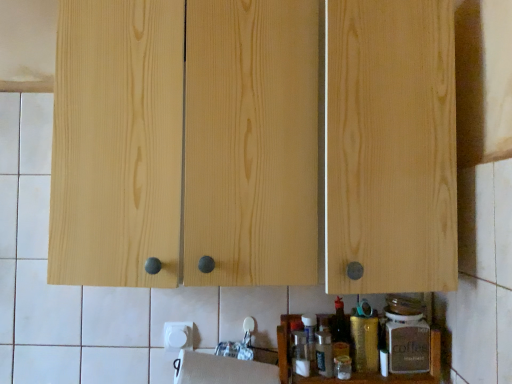
What is the approximate height of matte brown glass coffee jar at lower right, marked as the 1th bottle in a right-to-left arrangement?

The height of matte brown glass coffee jar at lower right, marked as the 1th bottle in a right-to-left arrangement, is 6.23 inches.

Find the location of a particular element. The image size is (512, 384). matte brown glass coffee jar at lower right, which ranks as the 2th bottle in left-to-right order is located at coordinates (407, 336).

Measure the distance between point (170, 325) and camera.

A distance of 1.25 meters exists between point (170, 325) and camera.

Image resolution: width=512 pixels, height=384 pixels. What are the coordinates of `matte brown glass coffee jar at lower right, which ranks as the 2th bottle in left-to-right order` in the screenshot? It's located at (407, 336).

Could you tell me if matte brown glass coffee jar at lower right, marked as the 1th bottle in a right-to-left arrangement, is facing gold metallic canister at lower center, placed as the first bottle when sorted from left to right?

No, matte brown glass coffee jar at lower right, marked as the 1th bottle in a right-to-left arrangement, is not oriented towards gold metallic canister at lower center, placed as the first bottle when sorted from left to right.

Can you see matte brown glass coffee jar at lower right, marked as the 1th bottle in a right-to-left arrangement, touching gold metallic canister at lower center, the 2th bottle viewed from the right?

Yes.

Is matte brown glass coffee jar at lower right, marked as the 1th bottle in a right-to-left arrangement, completely or partially outside of gold metallic canister at lower center, the 2th bottle viewed from the right?

Absolutely, matte brown glass coffee jar at lower right, marked as the 1th bottle in a right-to-left arrangement, is external to gold metallic canister at lower center, the 2th bottle viewed from the right.

The image size is (512, 384). There is a natural wood cabinet at center. Find the location of `the 1st bottle below it (from a real-world perspective)`. the 1st bottle below it (from a real-world perspective) is located at coordinates (407, 336).

Which is more to the right, natural wood cabinet at center or matte brown glass coffee jar at lower right, which ranks as the 2th bottle in left-to-right order?

Positioned to the right is matte brown glass coffee jar at lower right, which ranks as the 2th bottle in left-to-right order.

Considering the sizes of objects natural wood cabinet at center and matte brown glass coffee jar at lower right, marked as the 1th bottle in a right-to-left arrangement, in the image provided, who is wider, natural wood cabinet at center or matte brown glass coffee jar at lower right, marked as the 1th bottle in a right-to-left arrangement,?

natural wood cabinet at center is wider.

Between natural wood cabinet at center and matte brown glass coffee jar at lower right, marked as the 1th bottle in a right-to-left arrangement, which one has less height?

matte brown glass coffee jar at lower right, marked as the 1th bottle in a right-to-left arrangement.

How much distance is there between white matte paper towel at lower center and wooden spice rack at lower center?

A distance of 15.23 inches exists between white matte paper towel at lower center and wooden spice rack at lower center.

Does white matte paper towel at lower center have a lesser width compared to wooden spice rack at lower center?

Indeed, white matte paper towel at lower center has a lesser width compared to wooden spice rack at lower center.

Based on the photo, considering the relative sizes of white matte paper towel at lower center and wooden spice rack at lower center in the image provided, is white matte paper towel at lower center shorter than wooden spice rack at lower center?

Correct, white matte paper towel at lower center is not as tall as wooden spice rack at lower center.

In terms of size, does white matte paper towel at lower center appear bigger or smaller than wooden spice rack at lower center?

white matte paper towel at lower center is smaller than wooden spice rack at lower center.

You are a GUI agent. You are given a task and a screenshot of the screen. Output one action in this format:
    pyautogui.click(x=<x>, y=<y>)
    Task: Click on the cabinet that is in front of the white matte paper towel at lower center
    Image resolution: width=512 pixels, height=384 pixels.
    Given the screenshot: What is the action you would take?
    pyautogui.click(x=356, y=373)

Would you say wooden spice rack at lower center is inside or outside white matte paper towel at lower center?

wooden spice rack at lower center is outside white matte paper towel at lower center.

Is wooden spice rack at lower center shorter than white matte paper towel at lower center?

In fact, wooden spice rack at lower center may be taller than white matte paper towel at lower center.

Which is in front, point (372, 318) or point (420, 306)?

The point (420, 306) is more forward.

I want to click on bottle above the gold metallic canister at lower center, the 2th bottle viewed from the right (from the image's perspective), so click(407, 336).

Is gold metallic canister at lower center, the 2th bottle viewed from the right, turned away from matte brown glass coffee jar at lower right, which ranks as the 2th bottle in left-to-right order?

No, gold metallic canister at lower center, the 2th bottle viewed from the right, is not facing the opposite direction of matte brown glass coffee jar at lower right, which ranks as the 2th bottle in left-to-right order.

Is natural wood cabinet at center oriented away from wooden spice rack at lower center?

natural wood cabinet at center does not have its back to wooden spice rack at lower center.

From a real-world perspective, is natural wood cabinet at center physically below wooden spice rack at lower center?

No, from a real-world perspective, natural wood cabinet at center is not under wooden spice rack at lower center.

Is natural wood cabinet at center next to wooden spice rack at lower center?

No, natural wood cabinet at center is not next to wooden spice rack at lower center.

Does natural wood cabinet at center have a greater width compared to wooden spice rack at lower center?

Yes.

Between white matte paper towel at lower center and gold metallic canister at lower center, placed as the first bottle when sorted from left to right, which one appears on the right side from the viewer's perspective?

gold metallic canister at lower center, placed as the first bottle when sorted from left to right.

Is white matte paper towel at lower center oriented away from gold metallic canister at lower center, placed as the first bottle when sorted from left to right?

No, gold metallic canister at lower center, placed as the first bottle when sorted from left to right, is not at the back of white matte paper towel at lower center.

The width and height of the screenshot is (512, 384). What are the coordinates of `bottle above the gold metallic canister at lower center, placed as the first bottle when sorted from left to right (from a real-world perspective)` in the screenshot? It's located at (x=407, y=336).

At what (x,y) coordinates should I click in order to perform the action: click on the 1st bottle located beneath the natural wood cabinet at center (from a real-world perspective). Please return your answer as a coordinate pair (x, y). Looking at the image, I should click on (407, 336).

Which object lies nearer to the anchor point natural wood cabinet at center, matte brown glass coffee jar at lower right, marked as the 1th bottle in a right-to-left arrangement, or white matte paper towel at lower center?

Among the two, matte brown glass coffee jar at lower right, marked as the 1th bottle in a right-to-left arrangement, is located nearer to natural wood cabinet at center.

From the picture: Looking at the image, which one is located further to wooden spice rack at lower center, natural wood cabinet at center or matte brown glass coffee jar at lower right, marked as the 1th bottle in a right-to-left arrangement?

natural wood cabinet at center lies further to wooden spice rack at lower center than the other object.

Based on their spatial positions, is white matte paper towel at lower center or matte brown glass coffee jar at lower right, which ranks as the 2th bottle in left-to-right order, closer to wooden spice rack at lower center?

matte brown glass coffee jar at lower right, which ranks as the 2th bottle in left-to-right order.

When comparing their distances from gold metallic canister at lower center, the 2th bottle viewed from the right, does matte brown glass coffee jar at lower right, marked as the 1th bottle in a right-to-left arrangement, or white matte paper towel at lower center seem further?

white matte paper towel at lower center is positioned further to the anchor gold metallic canister at lower center, the 2th bottle viewed from the right.

Looking at the image, which one is located further to natural wood cabinet at center, gold metallic canister at lower center, the 2th bottle viewed from the right, or white matte paper towel at lower center?

white matte paper towel at lower center.

When comparing their distances from wooden spice rack at lower center, does natural wood cabinet at center or gold metallic canister at lower center, placed as the first bottle when sorted from left to right, seem closer?

gold metallic canister at lower center, placed as the first bottle when sorted from left to right, is positioned closer to the anchor wooden spice rack at lower center.

When comparing their distances from wooden spice rack at lower center, does gold metallic canister at lower center, placed as the first bottle when sorted from left to right, or natural wood cabinet at center seem further?

The object further to wooden spice rack at lower center is natural wood cabinet at center.

Looking at the image, which one is located further to gold metallic canister at lower center, placed as the first bottle when sorted from left to right, matte brown glass coffee jar at lower right, which ranks as the 2th bottle in left-to-right order, or wooden spice rack at lower center?

Among the two, wooden spice rack at lower center is located further to gold metallic canister at lower center, placed as the first bottle when sorted from left to right.

Locate an element on the screen. The height and width of the screenshot is (384, 512). bottle between white matte paper towel at lower center and matte brown glass coffee jar at lower right, which ranks as the 2th bottle in left-to-right order, in the horizontal direction is located at coordinates (364, 338).

The height and width of the screenshot is (384, 512). I want to click on cabinet located between white matte paper towel at lower center and gold metallic canister at lower center, placed as the first bottle when sorted from left to right, in the left-right direction, so click(x=356, y=373).

You are a GUI agent. You are given a task and a screenshot of the screen. Output one action in this format:
    pyautogui.click(x=<x>, y=<y>)
    Task: Click on the bottle situated between wooden spice rack at lower center and matte brown glass coffee jar at lower right, which ranks as the 2th bottle in left-to-right order, from left to right
    Image resolution: width=512 pixels, height=384 pixels.
    Given the screenshot: What is the action you would take?
    pyautogui.click(x=364, y=338)

Locate an element on the screen. This screenshot has width=512, height=384. paper towel that lies between natural wood cabinet at center and wooden spice rack at lower center from top to bottom is located at coordinates (178, 335).